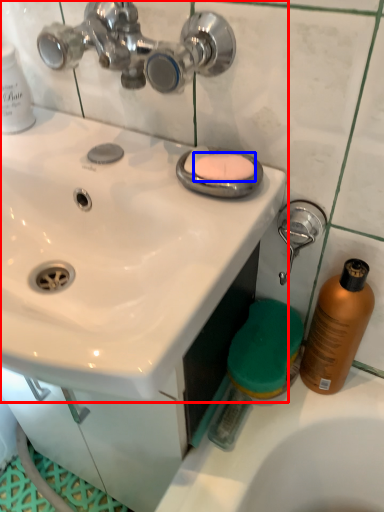
Question: Which of the following is the farthest to the observer, sink (highlighted by a red box) or soap (highlighted by a blue box)?

Choices:
 (A) sink
 (B) soap

Answer: (B)